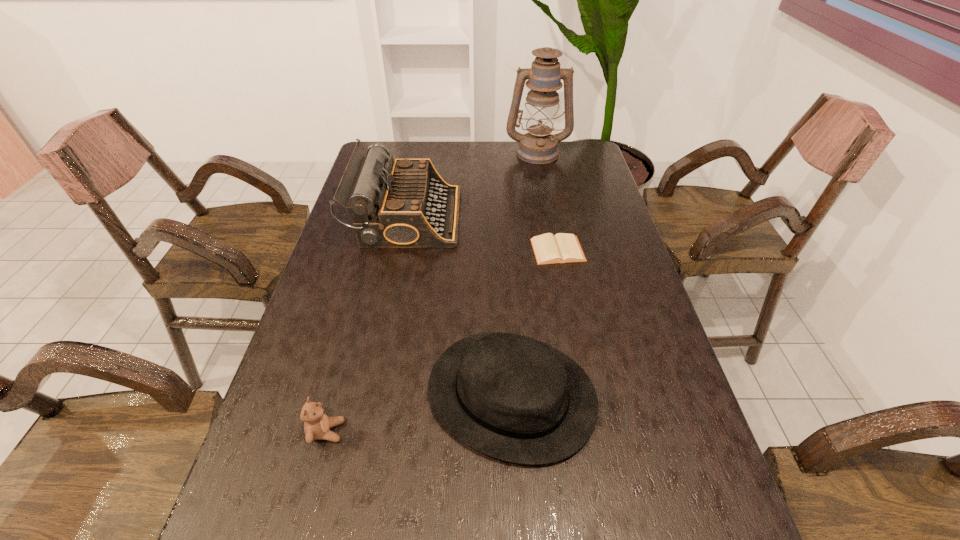
This screenshot has width=960, height=540. In the image, there is a desktop. In order to click on vacant space at the far right corner in this screenshot , I will do `click(597, 171)`.

Where is `vacant space that's between the teddy bear and the diary`? The height and width of the screenshot is (540, 960). vacant space that's between the teddy bear and the diary is located at coordinates (443, 341).

Image resolution: width=960 pixels, height=540 pixels. Identify the location of free area in between the fourth shortest object and the tallest object. pyautogui.click(x=472, y=185).

Where is `vacant area that lies between the second tallest object and the fedora`? This screenshot has width=960, height=540. vacant area that lies between the second tallest object and the fedora is located at coordinates (459, 306).

Find the location of a particular element. unoccupied position between the fedora and the tallest object is located at coordinates (524, 273).

Locate an element on the screen. The width and height of the screenshot is (960, 540). unoccupied area between the teddy bear and the typewriter is located at coordinates (367, 324).

The height and width of the screenshot is (540, 960). I want to click on vacant space that's between the typewriter and the teddy bear, so click(367, 324).

The width and height of the screenshot is (960, 540). What are the coordinates of `free space that is in between the typewriter and the diary` in the screenshot? It's located at (482, 233).

Where is `vacant space that is in between the fedora and the farthest object`? Image resolution: width=960 pixels, height=540 pixels. vacant space that is in between the fedora and the farthest object is located at coordinates (524, 273).

Where is `free space between the typewriter and the diary`? The width and height of the screenshot is (960, 540). free space between the typewriter and the diary is located at coordinates (482, 233).